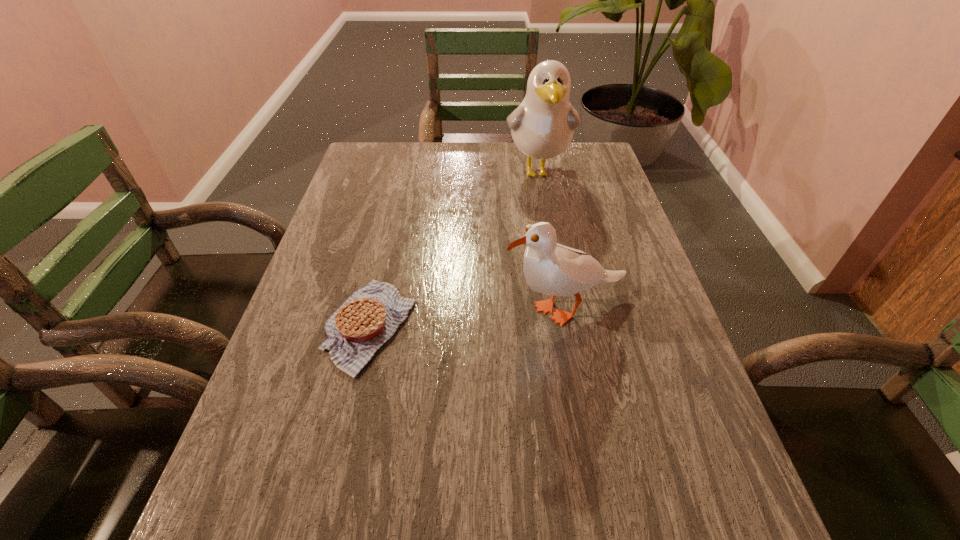
This screenshot has height=540, width=960. I want to click on the taller gull, so click(x=542, y=126).

Locate an element on the screen. This screenshot has height=540, width=960. the farthest object is located at coordinates (542, 126).

This screenshot has width=960, height=540. Identify the location of the nearer gull. (550, 268).

The image size is (960, 540). Find the location of `the shorter gull`. the shorter gull is located at coordinates (550, 268).

You are a GUI agent. You are given a task and a screenshot of the screen. Output one action in this format:
    pyautogui.click(x=<x>, y=<y>)
    Task: Click on the pie
    This screenshot has height=540, width=960.
    Given the screenshot: What is the action you would take?
    pyautogui.click(x=366, y=320)

This screenshot has height=540, width=960. Identify the location of the shortest object. (366, 320).

The image size is (960, 540). What are the coordinates of `vacant area situated 0.170m on the beak of the farthest object` in the screenshot? It's located at (548, 229).

In order to click on free space located at the beak of the shorter gull in this screenshot , I will do `click(376, 309)`.

Find the location of a particular element. The height and width of the screenshot is (540, 960). vacant space located at the beak of the shorter gull is located at coordinates (450, 309).

Locate an element on the screen. This screenshot has height=540, width=960. free spot located 0.270m at the beak of the shorter gull is located at coordinates (385, 309).